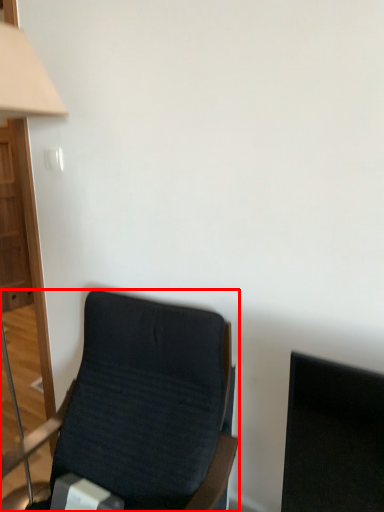
Question: From the image's perspective, where is chair (annotated by the red box) located relative to table lamp?

Choices:
 (A) below
 (B) above

Answer: (A)